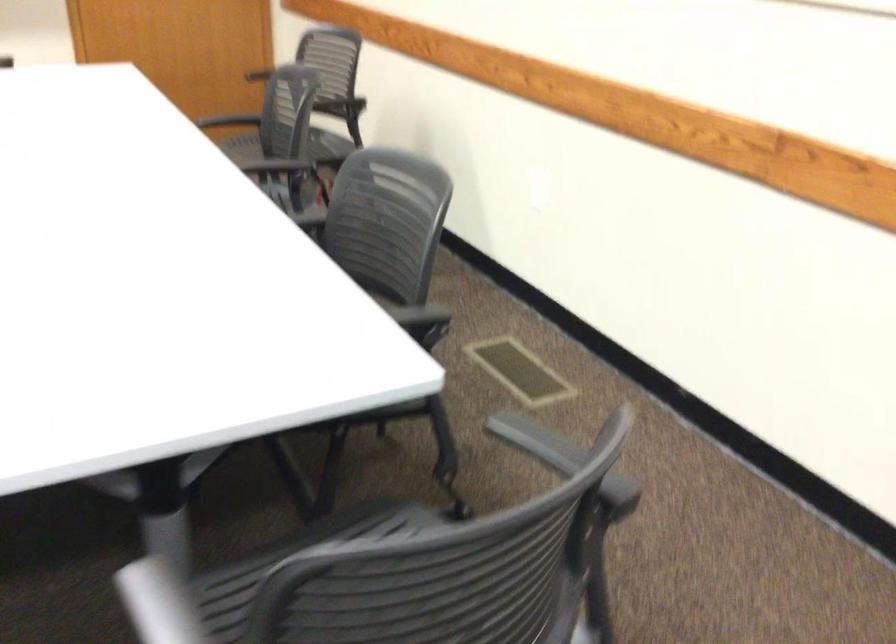
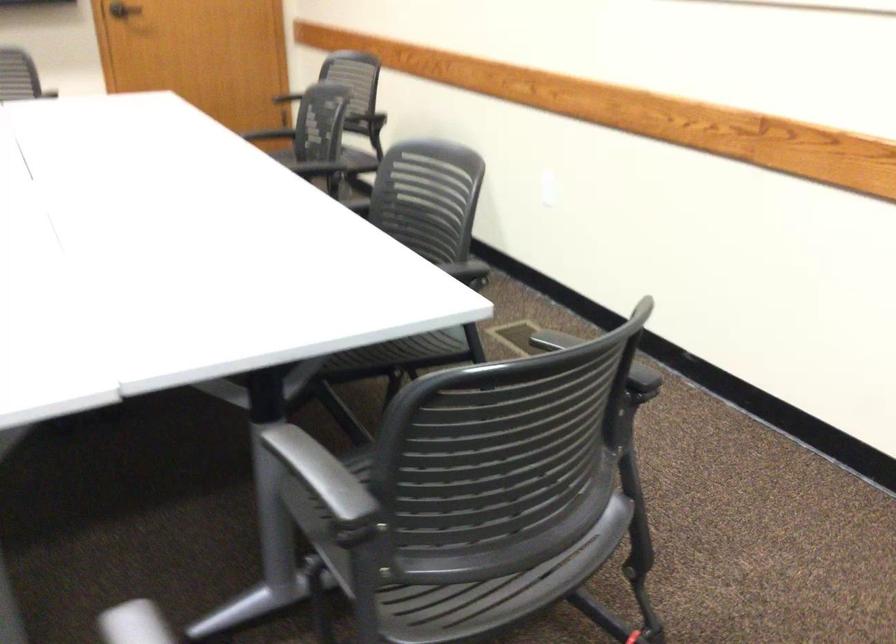
The point at [565,509] is marked in the first image. Where is the corresponding point in the second image?

(598, 359)